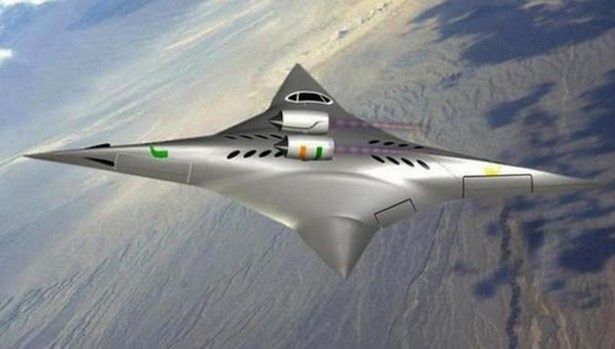
In order to click on 1 window on object in this screenshot , I will do `click(312, 99)`.